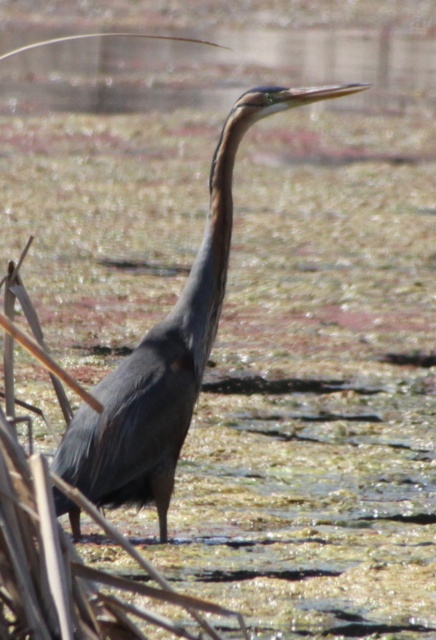
Who is higher up, shiny dark blue heron at center or shiny purple neck at center?

shiny purple neck at center

Which is more to the right, shiny dark blue heron at center or shiny purple neck at center?

shiny purple neck at center

The image size is (436, 640). Describe the element at coordinates (169, 349) in the screenshot. I see `shiny dark blue heron at center` at that location.

This screenshot has height=640, width=436. Find the location of `shiny dark blue heron at center`. shiny dark blue heron at center is located at coordinates (169, 349).